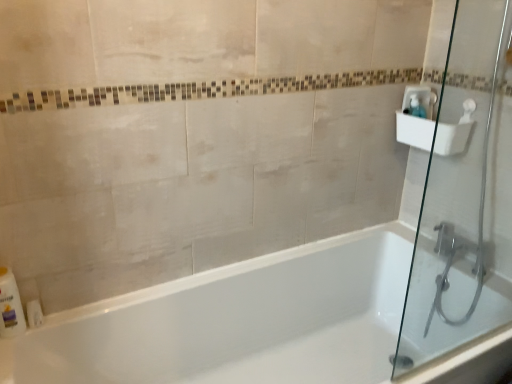
Question: Considering the positions of white plastic bottle at lower left and white glossy bathtub at center in the image, is white plastic bottle at lower left wider or thinner than white glossy bathtub at center?

Choices:
 (A) wide
 (B) thin

Answer: (B)

Question: Is point (1, 324) positioned closer to the camera than point (271, 337)?

Choices:
 (A) farther
 (B) closer

Answer: (B)

Question: Estimate the real-world distances between objects in this image. Which object is farther from the white glossy bathtub at center?

Choices:
 (A) white plastic bottle at lower left
 (B) white plastic sink at upper right
 (C) transparent glass shower door at right
 (D) clear plastic soap dispenser at upper right

Answer: (D)

Question: Based on their relative distances, which object is nearer to the white plastic sink at upper right?

Choices:
 (A) white plastic bottle at lower left
 (B) clear plastic soap dispenser at upper right
 (C) white glossy bathtub at center
 (D) transparent glass shower door at right

Answer: (B)